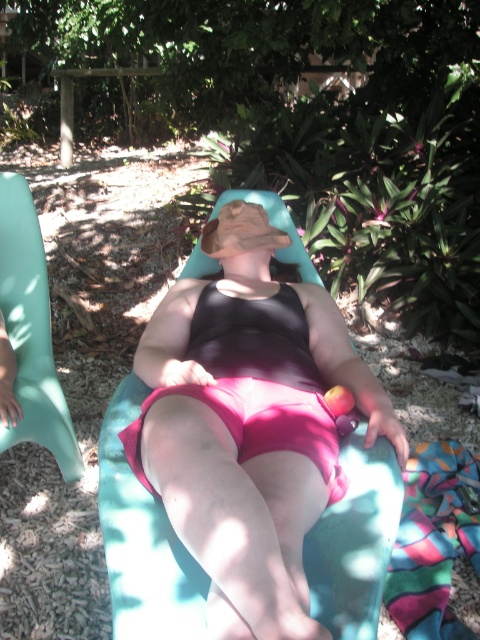
Who is taller, pink matte swimsuit at center or teal plastic beach chair at left?

teal plastic beach chair at left

Consider the image. Between pink matte swimsuit at center and teal plastic beach chair at left, which one appears on the left side from the viewer's perspective?

teal plastic beach chair at left

Between point (259, 508) and point (43, 296), which one is positioned behind?

The point (43, 296) is more distant.

Identify the location of pink matte swimsuit at center. (249, 424).